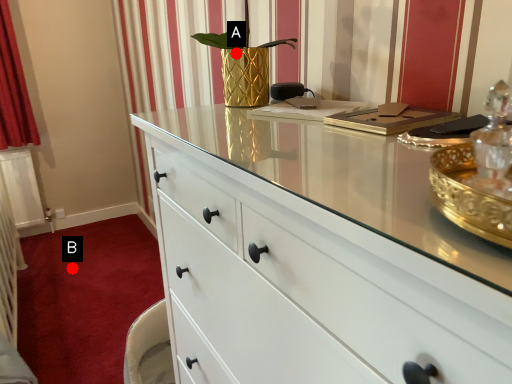
Question: Two points are circled on the image, labeled by A and B beside each circle. Which point appears farthest from the camera in this image?

Choices:
 (A) A is further
 (B) B is further

Answer: (B)